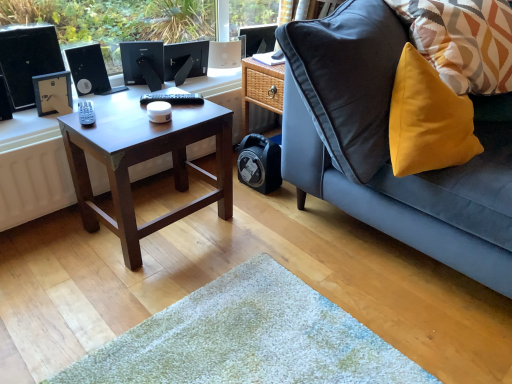
Image resolution: width=512 pixels, height=384 pixels. Identify the location of free space to the right of dark brown wood coffee table at center. (258, 236).